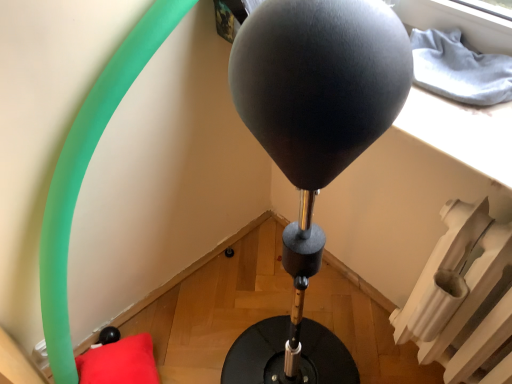
Question: Is red plush pillow at lower left aimed at black matte balloon at center?

Choices:
 (A) yes
 (B) no

Answer: (B)

Question: Can you confirm if red plush pillow at lower left is thinner than black matte balloon at center?

Choices:
 (A) no
 (B) yes

Answer: (B)

Question: Is there a large distance between red plush pillow at lower left and black matte balloon at center?

Choices:
 (A) no
 (B) yes

Answer: (B)

Question: Is red plush pillow at lower left at the right side of black matte balloon at center?

Choices:
 (A) yes
 (B) no

Answer: (B)

Question: Can you see red plush pillow at lower left touching black matte balloon at center?

Choices:
 (A) yes
 (B) no

Answer: (B)

Question: Based on their sizes in the image, would you say red plush pillow at lower left is bigger or smaller than black matte balloon at center?

Choices:
 (A) small
 (B) big

Answer: (A)

Question: Is point (130, 344) positioned closer to the camera than point (287, 119)?

Choices:
 (A) farther
 (B) closer

Answer: (A)

Question: From the image's perspective, is red plush pillow at lower left positioned above or below black matte balloon at center?

Choices:
 (A) above
 (B) below

Answer: (B)

Question: From a real-world perspective, is red plush pillow at lower left physically located above or below black matte balloon at center?

Choices:
 (A) below
 (B) above

Answer: (A)

Question: Considering the positions of point [455, 225] and point [270, 112], is point [455, 225] closer or farther from the camera than point [270, 112]?

Choices:
 (A) farther
 (B) closer

Answer: (A)

Question: Considering the positions of white plastic radiator at lower right and black matte balloon at center in the image, is white plastic radiator at lower right bigger or smaller than black matte balloon at center?

Choices:
 (A) small
 (B) big

Answer: (B)

Question: Considering the relative positions of white plastic radiator at lower right and black matte balloon at center in the image provided, is white plastic radiator at lower right to the left or to the right of black matte balloon at center?

Choices:
 (A) left
 (B) right

Answer: (B)

Question: In terms of height, does white plastic radiator at lower right look taller or shorter compared to black matte balloon at center?

Choices:
 (A) tall
 (B) short

Answer: (A)

Question: Is black matte balloon at center wider or thinner than red plush pillow at lower left?

Choices:
 (A) wide
 (B) thin

Answer: (A)

Question: Considering their positions, is black matte balloon at center located in front of or behind red plush pillow at lower left?

Choices:
 (A) behind
 (B) front

Answer: (B)